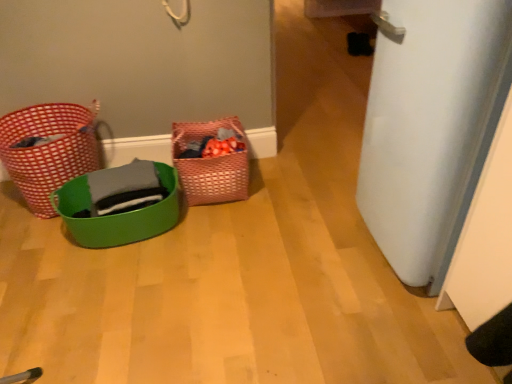
Question: Considering the relative positions of red woven basket at left, the 1th basket in the left-to-right sequence, and white matte door at right in the image provided, is red woven basket at left, the 1th basket in the left-to-right sequence, to the left or to the right of white matte door at right?

Choices:
 (A) left
 (B) right

Answer: (A)

Question: In terms of height, does red woven basket at left, the 1th basket in the left-to-right sequence, look taller or shorter compared to white matte door at right?

Choices:
 (A) short
 (B) tall

Answer: (A)

Question: Which is nearer to the green plastic basket at lower left, marked as the second basket in a right-to-left arrangement?

Choices:
 (A) woven pink basket at center, marked as the third basket in a left-to-right arrangement
 (B) white matte door at right
 (C) red woven basket at left, the 1th basket in the left-to-right sequence

Answer: (A)

Question: Which is nearer to the green plastic basket at lower left, the second basket when ordered from left to right?

Choices:
 (A) woven pink basket at center, arranged as the 1th basket when viewed from the right
 (B) red woven basket at left, the 1th basket in the left-to-right sequence
 (C) white matte door at right

Answer: (A)